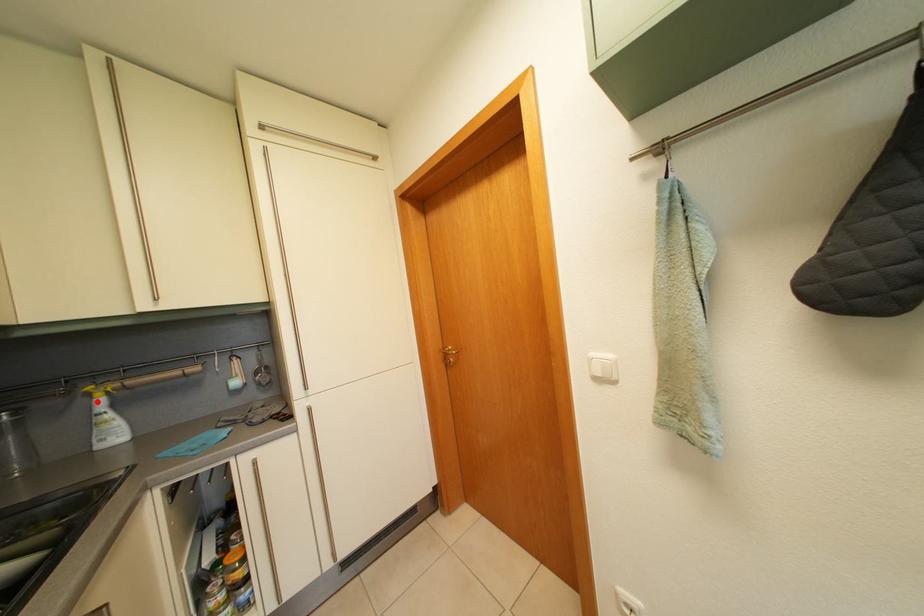
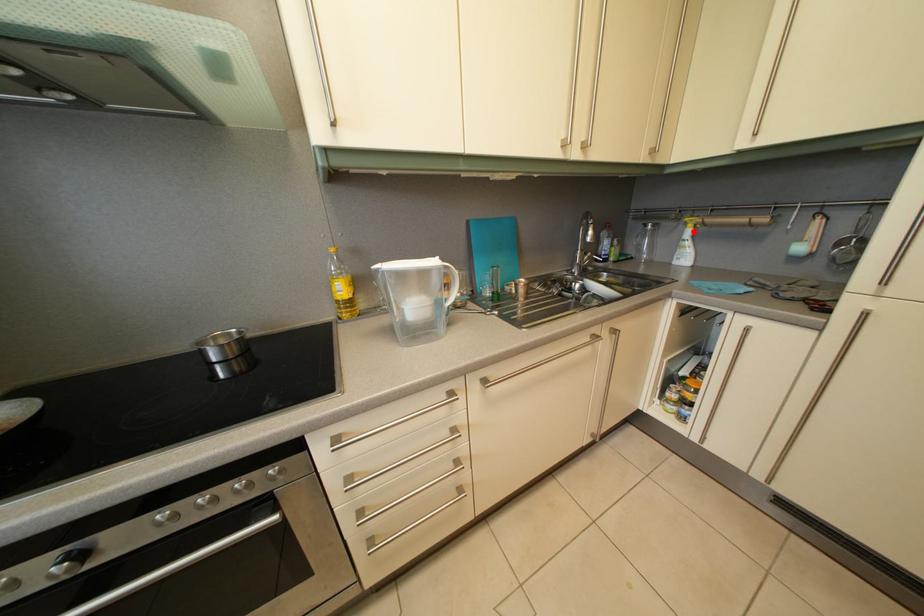
I am providing you with two images of the same scene from different viewpoints. A red point is marked on the first image and another point is marked on the second image. Are the points marked in image1 and image2 representing the same 3D position?

Yes